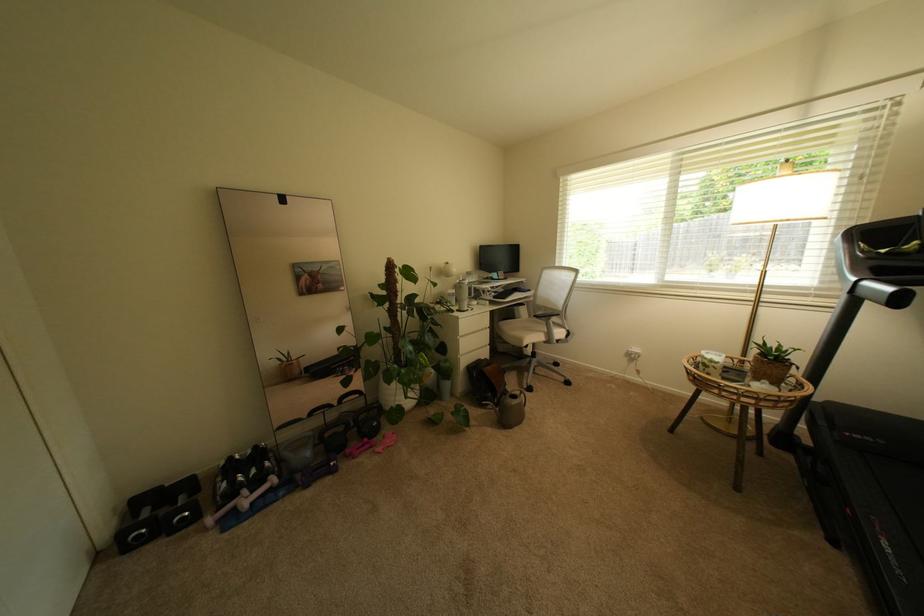
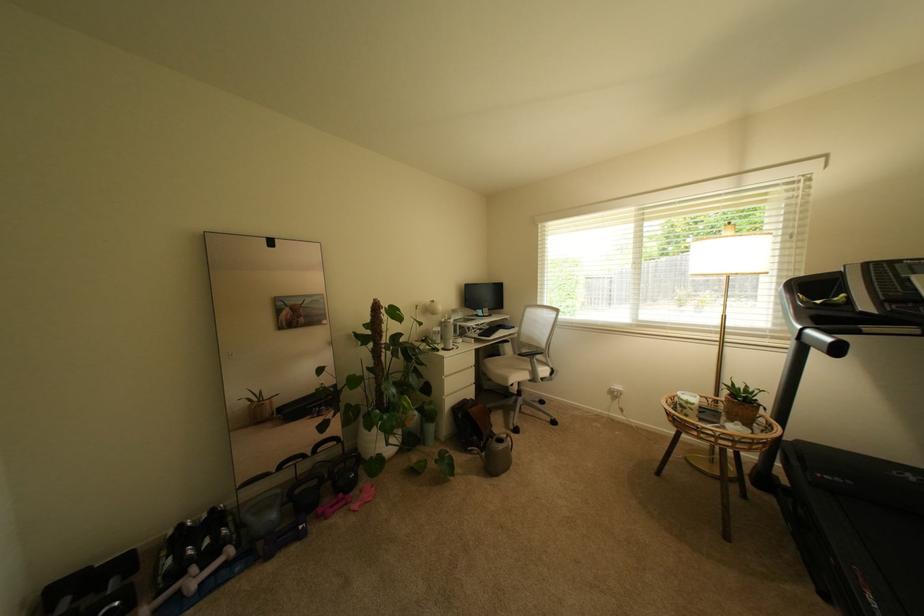
The point at (261, 472) is marked in the first image. Where is the corresponding point in the second image?

(215, 543)